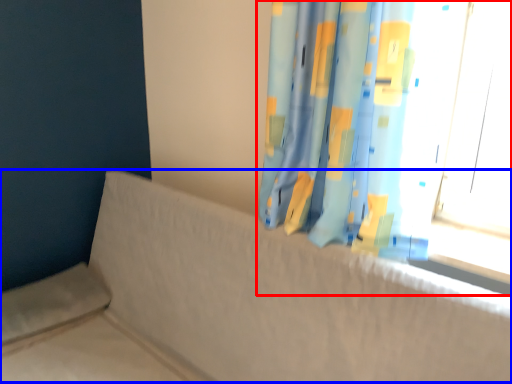
Question: Which point is closer to the camera, curtain (highlighted by a red box) or couch (highlighted by a blue box)?

Choices:
 (A) curtain
 (B) couch

Answer: (B)